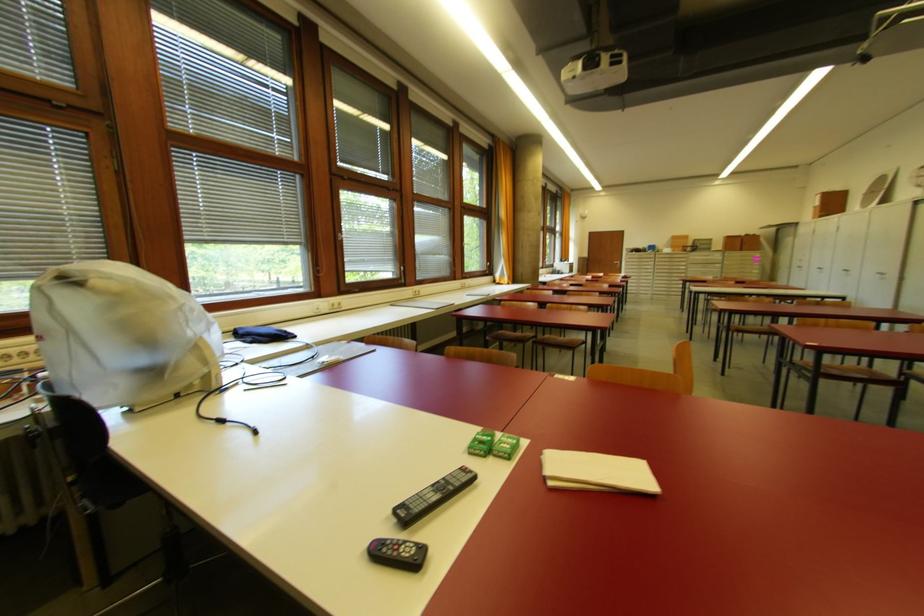
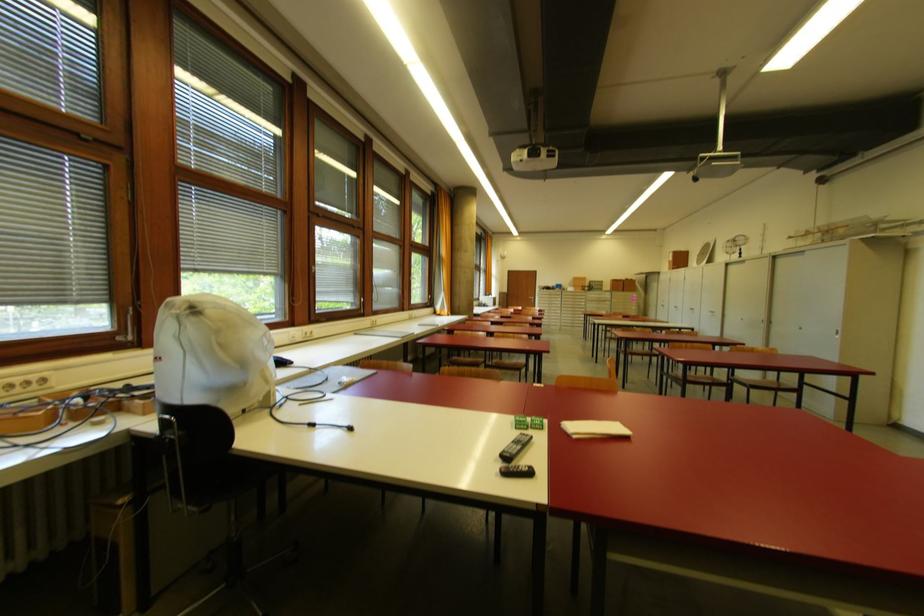
Where in the second image is the point corresponding to (472,477) from the first image?

(531, 439)